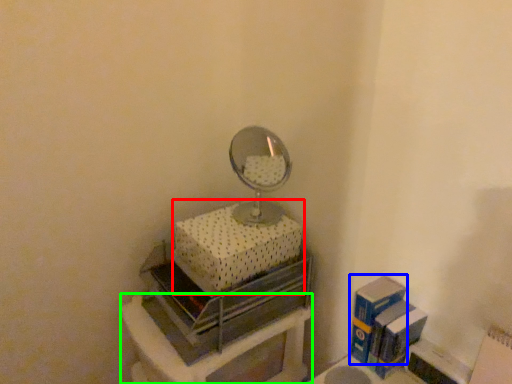
Question: Which is nearer to the box (highlighted by a red box)? box (highlighted by a blue box) or furniture (highlighted by a green box).

Choices:
 (A) box
 (B) furniture

Answer: (B)